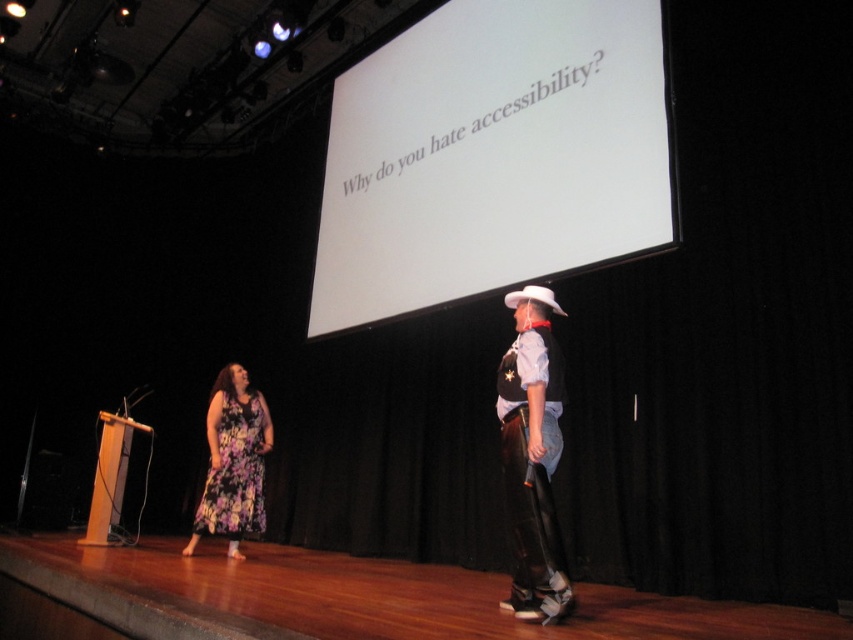
Who is higher up, white matte projection screen at upper center or floral fabric dress at lower left?

white matte projection screen at upper center is above.

Does white matte projection screen at upper center appear under floral fabric dress at lower left?

Incorrect, white matte projection screen at upper center is not positioned below floral fabric dress at lower left.

Is point (653, 38) farther from camera compared to point (223, 404)?

No, (653, 38) is closer to viewer.

The height and width of the screenshot is (640, 853). I want to click on white matte projection screen at upper center, so click(x=492, y=156).

Which is below, leather cowboy boots at right or floral fabric dress at lower left?

floral fabric dress at lower left is below.

Is leather cowboy boots at right below floral fabric dress at lower left?

No, leather cowboy boots at right is not below floral fabric dress at lower left.

Is point (517, 515) less distant than point (233, 483)?

That is True.

You are a GUI agent. You are given a task and a screenshot of the screen. Output one action in this format:
    pyautogui.click(x=<x>, y=<y>)
    Task: Click on the leather cowboy boots at right
    The width and height of the screenshot is (853, 640).
    Given the screenshot: What is the action you would take?
    pyautogui.click(x=532, y=456)

Can you confirm if white matte projection screen at upper center is wider than leather cowboy boots at right?

Correct, the width of white matte projection screen at upper center exceeds that of leather cowboy boots at right.

Find the location of a particular element. Image resolution: width=853 pixels, height=640 pixels. white matte projection screen at upper center is located at coordinates (492, 156).